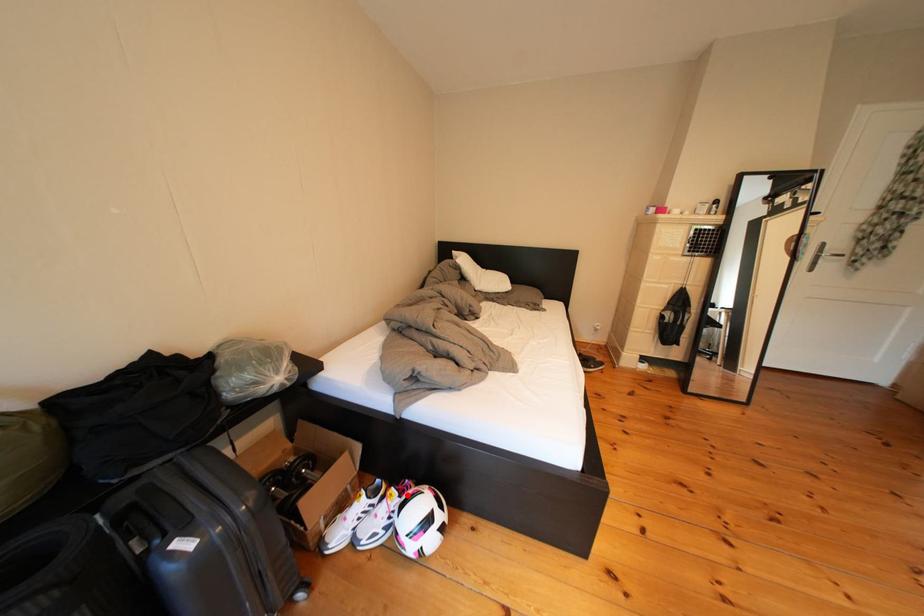
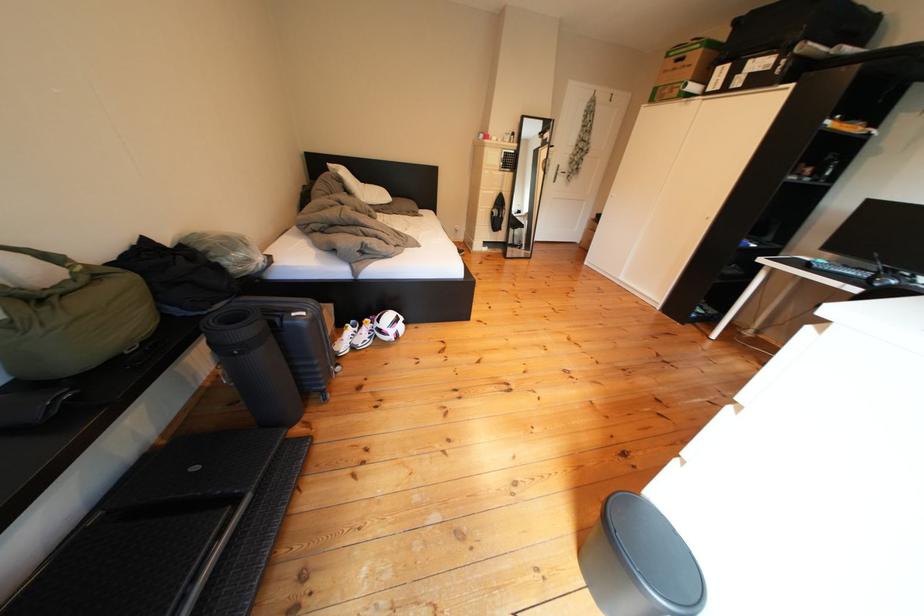
Question: I am providing you with two images of the same scene from different viewpoints. A red point is shown in image1. For the corresponding object point in image2, is it positioned nearer or farther from the camera?

Choices:
 (A) Nearer
 (B) Farther

Answer: (B)